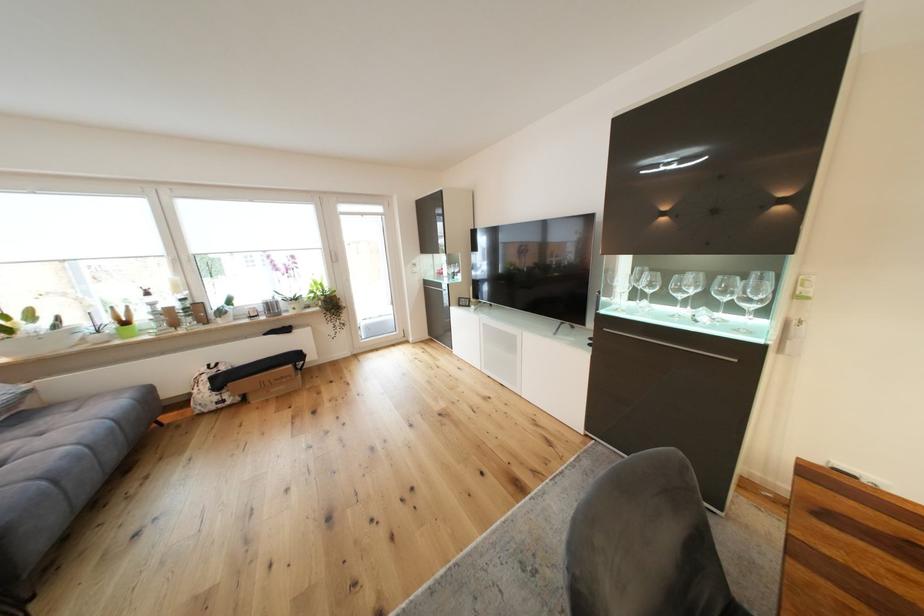
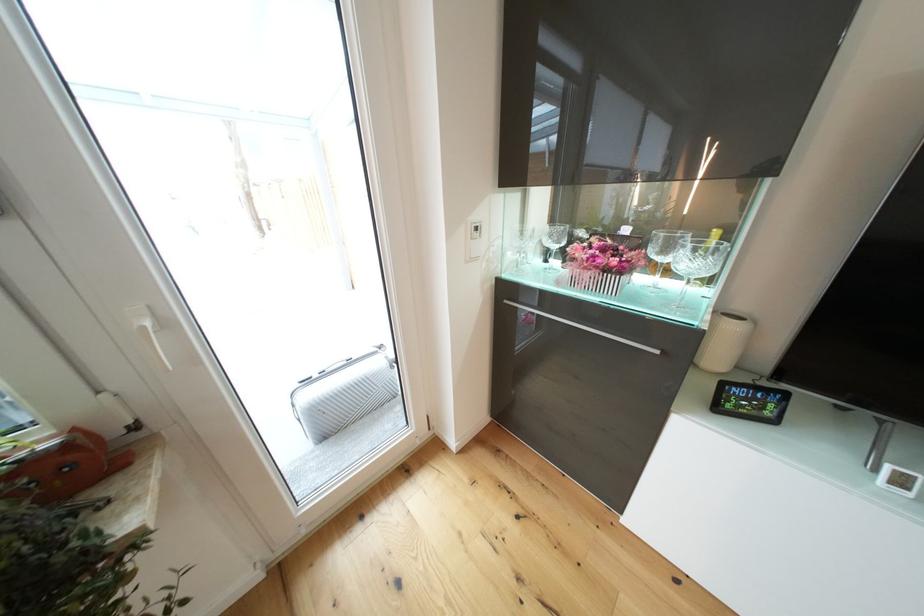
The images are taken continuously from a first-person perspective. In which direction are you moving?

The cameraman moved toward left, forward.